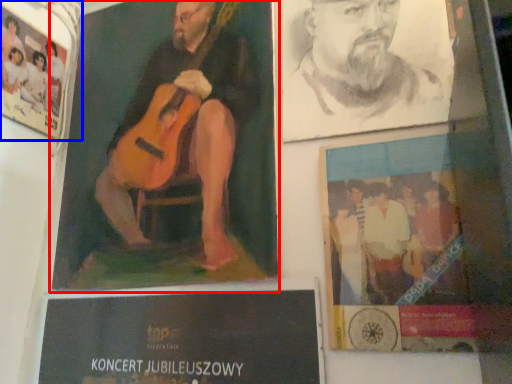
Question: Among these objects, which one is farthest to the camera, poster (highlighted by a red box) or poster (highlighted by a blue box)?

Choices:
 (A) poster
 (B) poster

Answer: (B)